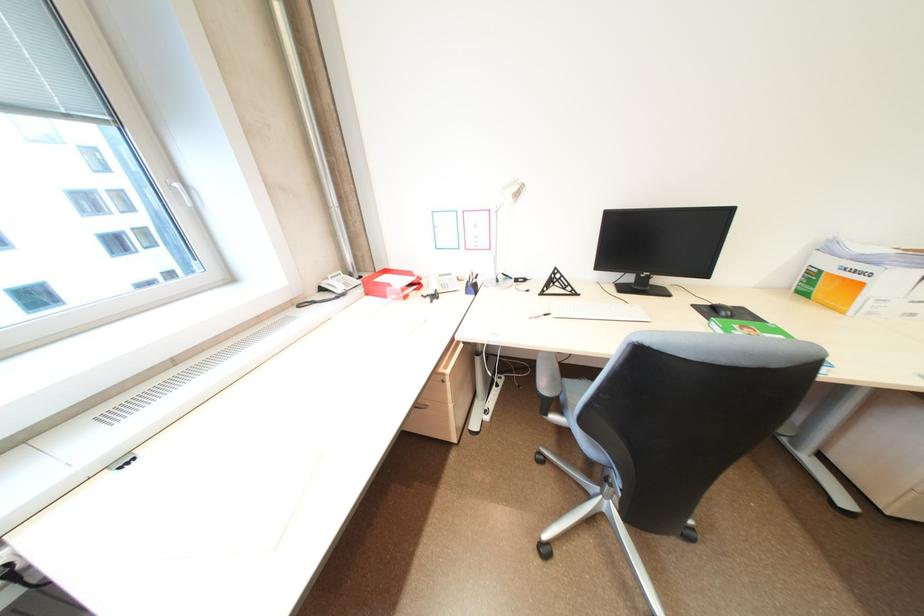
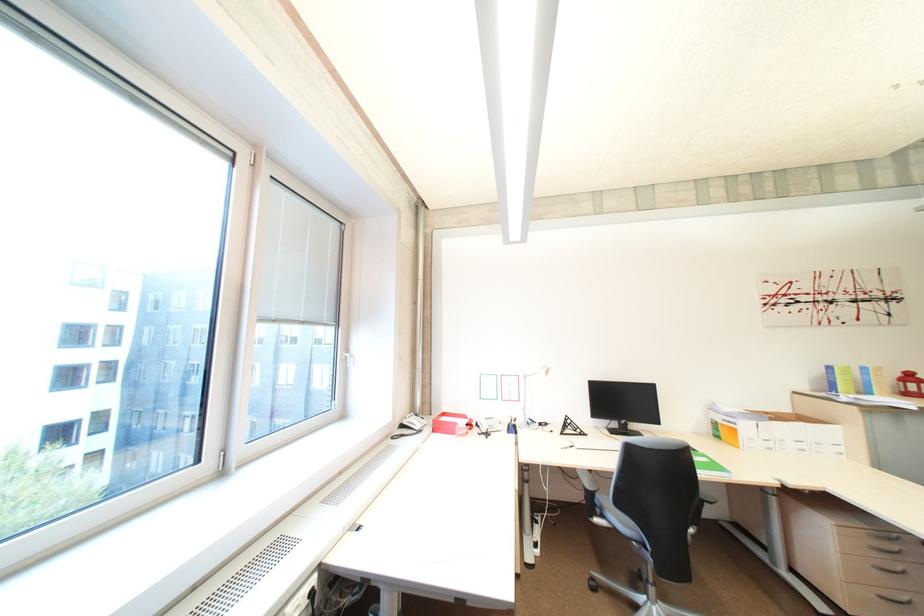
Find the pixel in the second image that matches (x=869, y=286) in the first image.

(745, 431)